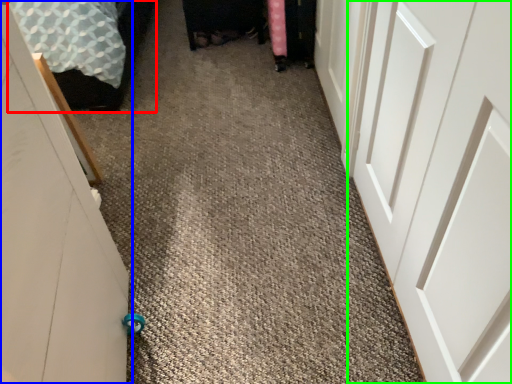
Question: Estimate the real-world distances between objects in this image. Which object is farther from bed (highlighted by a red box), door (highlighted by a blue box) or door (highlighted by a green box)?

Choices:
 (A) door
 (B) door

Answer: (B)